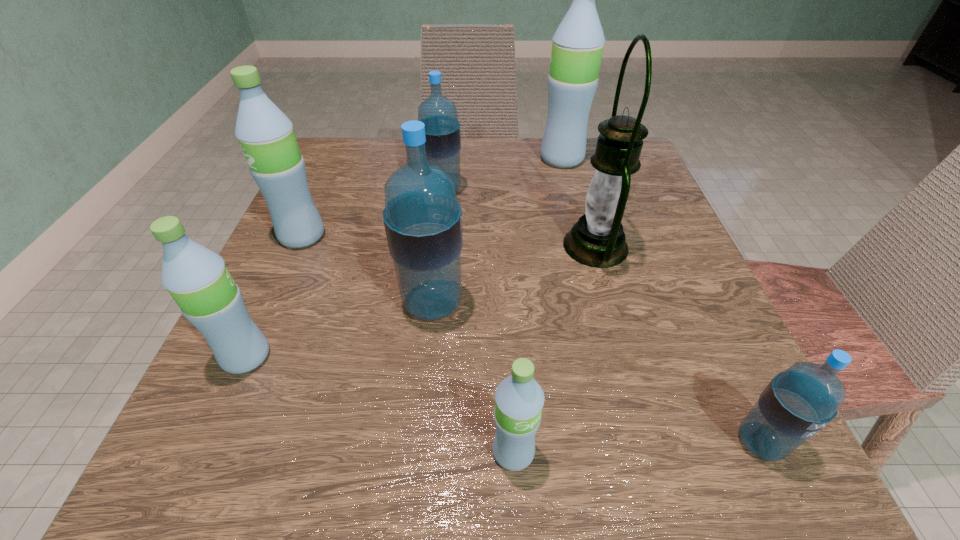
Identify the location of free spot that satisfies the following two spatial constraints: 1. on the back side of the sixth water bottle from left to right; 2. on the right side of the second farthest object. This screenshot has height=540, width=960. (446, 158).

This screenshot has height=540, width=960. In order to click on vacant region that satisfies the following two spatial constraints: 1. on the front side of the rightmost blue water bottle; 2. on the left side of the seventh nearest object in this screenshot , I will do `click(417, 442)`.

At what (x,y) coordinates should I click in order to perform the action: click on free space that satisfies the following two spatial constraints: 1. on the front side of the fifth object from left to right; 2. on the right side of the fifth farthest object. Please return your answer as a coordinate pair (x, y). This screenshot has width=960, height=540. Looking at the image, I should click on (418, 452).